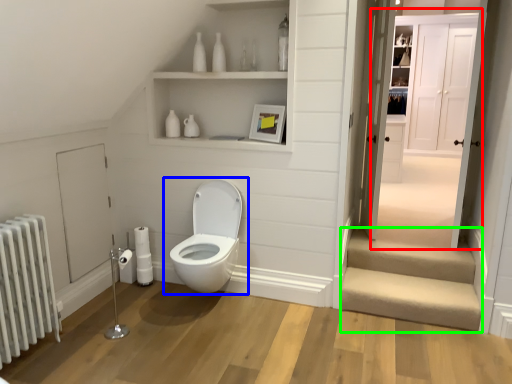
Question: Which object is positioned closest to door (highlighted by a red box)? Select from toilet (highlighted by a blue box) and stairwell (highlighted by a green box).

Choices:
 (A) toilet
 (B) stairwell

Answer: (B)